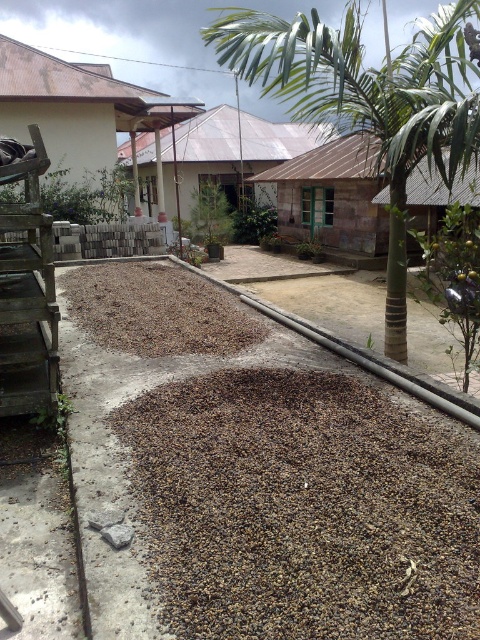
You are a gardener planning to plant a new shrub in the dark brown gravel at center. The shrub requires a minimum of 2 meters of clearance above it to grow properly. Given the height of the green leafy palm tree at upper center, do you think the area is suitable for planting the shrub?

The dark brown gravel at center is not as tall as the green leafy palm tree at upper center, which implies the palm tree is taller. Since the shrub needs 2 meters of clearance, the height of the palm tree would not obstruct the shrub if it is positioned away from the tree. However, the gravel area itself does not have height, so the main concern is the palm tree. If the palm tree is over 2 meters tall, planting the shrub nearby might be suitable as long as it is placed where the tree doesn